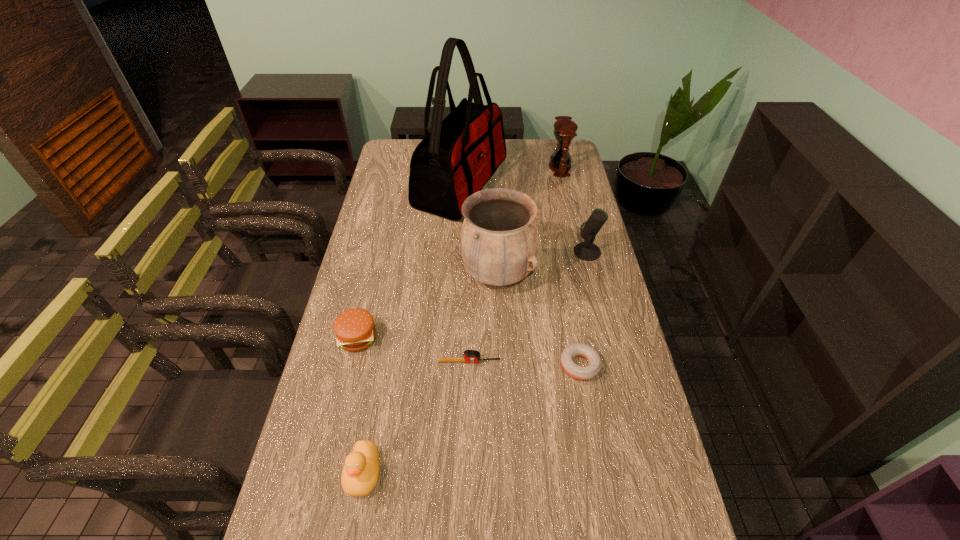
Where is `duck present at the left edge`? duck present at the left edge is located at coordinates (360, 473).

This screenshot has width=960, height=540. I want to click on hamburger that is at the left edge, so click(x=354, y=328).

The height and width of the screenshot is (540, 960). Identify the location of hourglass that is at the right edge. (565, 129).

Where is `microphone situated at the right edge`? microphone situated at the right edge is located at coordinates (587, 251).

Where is `doughnut at the right edge`? doughnut at the right edge is located at coordinates (590, 371).

This screenshot has height=540, width=960. I want to click on object at the far left corner, so click(x=461, y=153).

Locate an element on the screen. This screenshot has width=960, height=540. object located at the far right corner is located at coordinates (565, 129).

Locate an element on the screen. This screenshot has height=540, width=960. vacant space at the left edge of the desktop is located at coordinates (327, 476).

I want to click on free space at the right edge of the desktop, so click(x=548, y=168).

You are a GUI agent. You are given a task and a screenshot of the screen. Output one action in this format:
    pyautogui.click(x=<x>, y=<y>)
    Task: Click on the vacant area between the duck and the doughnut
    
    Given the screenshot: What is the action you would take?
    pyautogui.click(x=471, y=419)